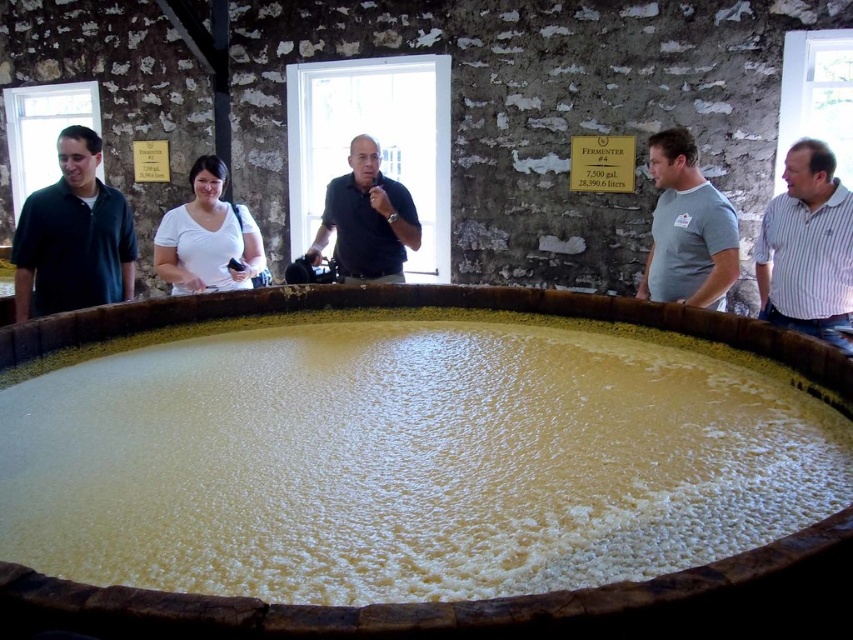
You are a photographer trying to capture a group photo of the green matte shirt at left and the white matte shirt at center. Since you want both subjects to be in focus, you need to ensure they are at the same distance from the camera. Given their current positions, which person should move forward to align their distances?

The white matte shirt at center should move forward because the green matte shirt at left is taller, so to balance their distance from the camera for the photo, the shorter white matte shirt at center needs to step closer.